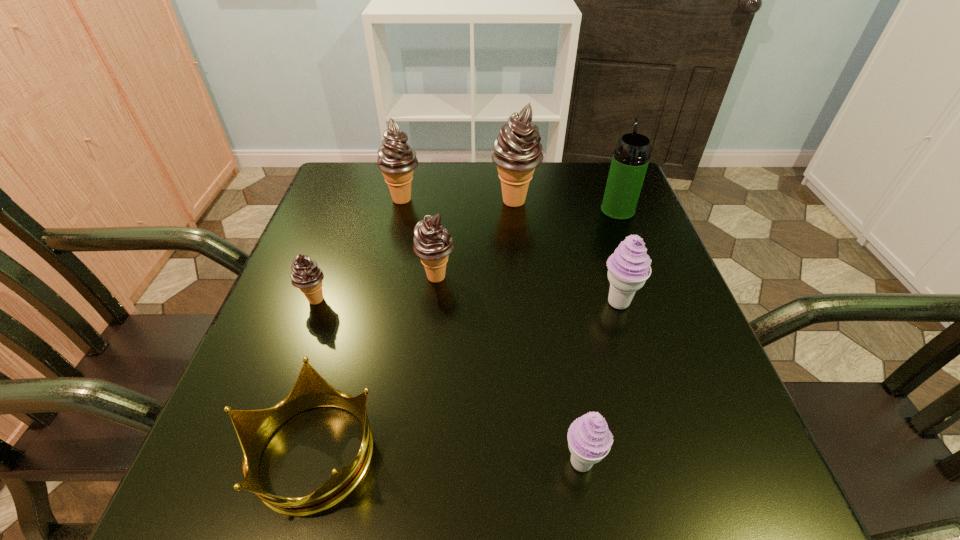
Choose which object is the nearest neighbor to the bigger purple icecream. Please provide its 2D coordinates. Your answer should be formatted as a tuple, i.e. [(x, y)], where the tuple contains the x and y coordinates of a point satisfying the conditions above.

[(630, 160)]

The width and height of the screenshot is (960, 540). I want to click on icecream that is the fourth closest to the shortest object, so click(x=629, y=267).

Select which icecream is the second closest to the fifth shortest icecream. Please provide its 2D coordinates. Your answer should be formatted as a tuple, i.e. [(x, y)], where the tuple contains the x and y coordinates of a point satisfying the conditions above.

[(432, 243)]

This screenshot has width=960, height=540. I want to click on chocolate icecream that is the second closest to the gold crown, so click(432, 243).

This screenshot has height=540, width=960. I want to click on the third closest chocolate icecream to the leftmost chocolate icecream, so click(517, 152).

Image resolution: width=960 pixels, height=540 pixels. I want to click on free space that satisfies the following two spatial constraints: 1. on the back side of the fourth object from left to right; 2. on the left side of the smallest chocolate icecream, so click(x=324, y=278).

Locate an element on the screen. Image resolution: width=960 pixels, height=540 pixels. free space that satisfies the following two spatial constraints: 1. on the front side of the biggest chocolate icecream; 2. on the left side of the smaller purple icecream is located at coordinates (540, 461).